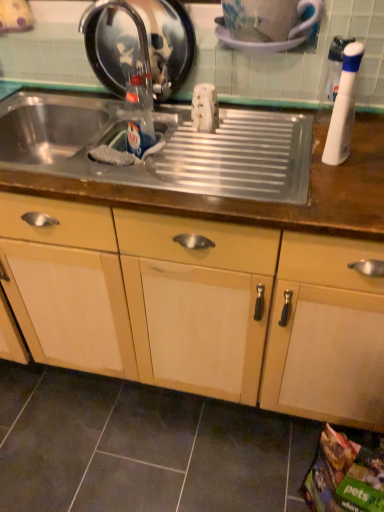
Where is `vacant region in front of white plastic bottle at right, which appears as the 2th bottle when viewed from the back`? vacant region in front of white plastic bottle at right, which appears as the 2th bottle when viewed from the back is located at coordinates (335, 189).